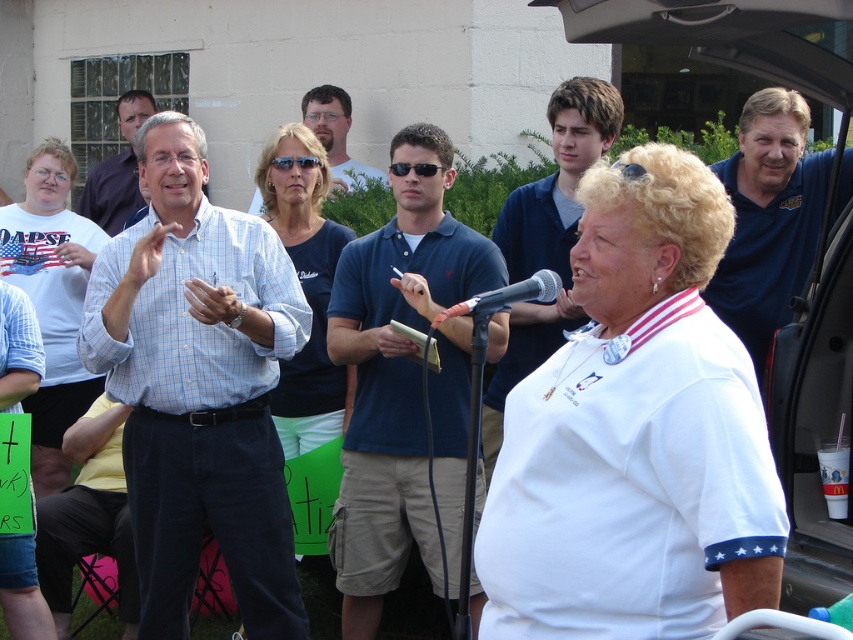
Based on the coordinates provided, which object corresponds to the point at position (117, 170)?

The point at (117, 170) corresponds to the light blue shirt at center.

You are a photographer at the event and want to capture a photo where both the light blue plaid shirt at center and the dark blue polo shirt at center are visible. Based on their heights, which one should be positioned closer to the front to ensure both are fully visible in the frame?

The light blue plaid shirt at center is shorter than the dark blue polo shirt at center, so positioning the light blue plaid shirt at center closer to the front will ensure both are fully visible in the frame.